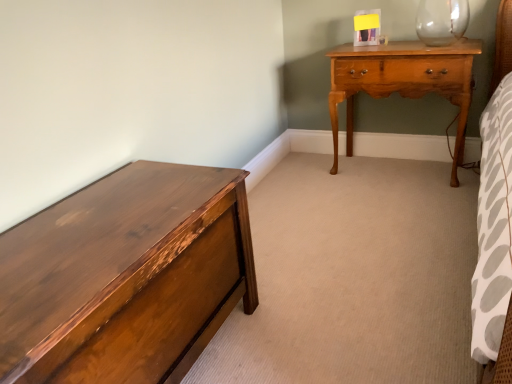
Question: Based on their positions, is shiny brown wood chest of drawers at left located to the left or right of light brown wood nightstand at upper right?

Choices:
 (A) left
 (B) right

Answer: (A)

Question: From a real-world perspective, is shiny brown wood chest of drawers at left positioned above or below light brown wood nightstand at upper right?

Choices:
 (A) below
 (B) above

Answer: (A)

Question: Considering the positions of shiny brown wood chest of drawers at left and light brown wood nightstand at upper right in the image, is shiny brown wood chest of drawers at left wider or thinner than light brown wood nightstand at upper right?

Choices:
 (A) thin
 (B) wide

Answer: (B)

Question: Looking at their shapes, would you say light brown wood nightstand at upper right is wider or thinner than shiny brown wood chest of drawers at left?

Choices:
 (A) wide
 (B) thin

Answer: (B)

Question: Considering the relative positions of light brown wood nightstand at upper right and shiny brown wood chest of drawers at left in the image provided, is light brown wood nightstand at upper right to the left or to the right of shiny brown wood chest of drawers at left?

Choices:
 (A) right
 (B) left

Answer: (A)

Question: Looking at the image, does light brown wood nightstand at upper right seem bigger or smaller compared to shiny brown wood chest of drawers at left?

Choices:
 (A) small
 (B) big

Answer: (A)

Question: Is light brown wood nightstand at upper right inside the boundaries of shiny brown wood chest of drawers at left, or outside?

Choices:
 (A) inside
 (B) outside

Answer: (B)